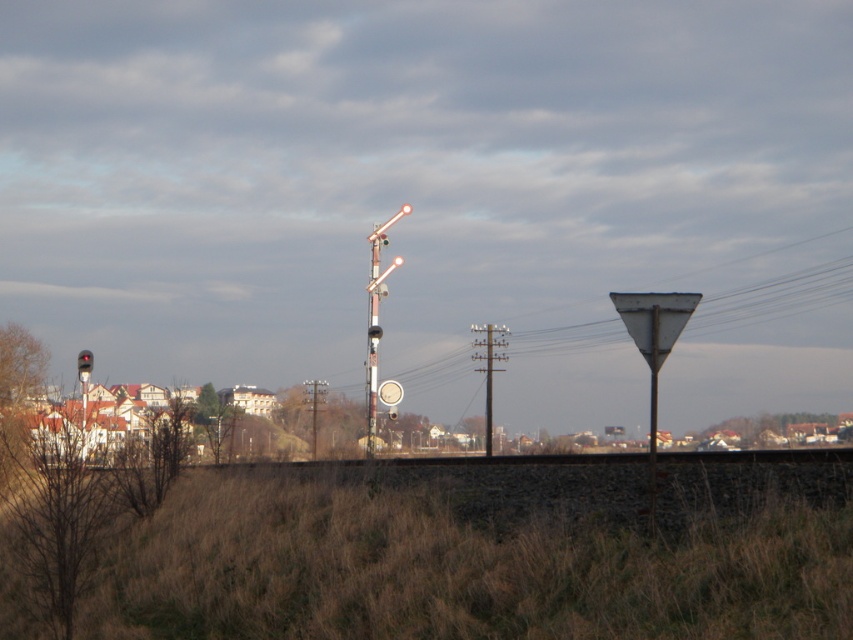
Does metallic signal pole at center appear on the right side of metallic pole at center?

In fact, metallic signal pole at center is to the left of metallic pole at center.

Does metallic signal pole at center have a lesser height compared to metallic pole at center?

In fact, metallic signal pole at center may be taller than metallic pole at center.

Which is in front, point (370, 372) or point (483, 342)?

Point (370, 372) is more forward.

This screenshot has height=640, width=853. I want to click on metallic signal pole at center, so click(x=372, y=336).